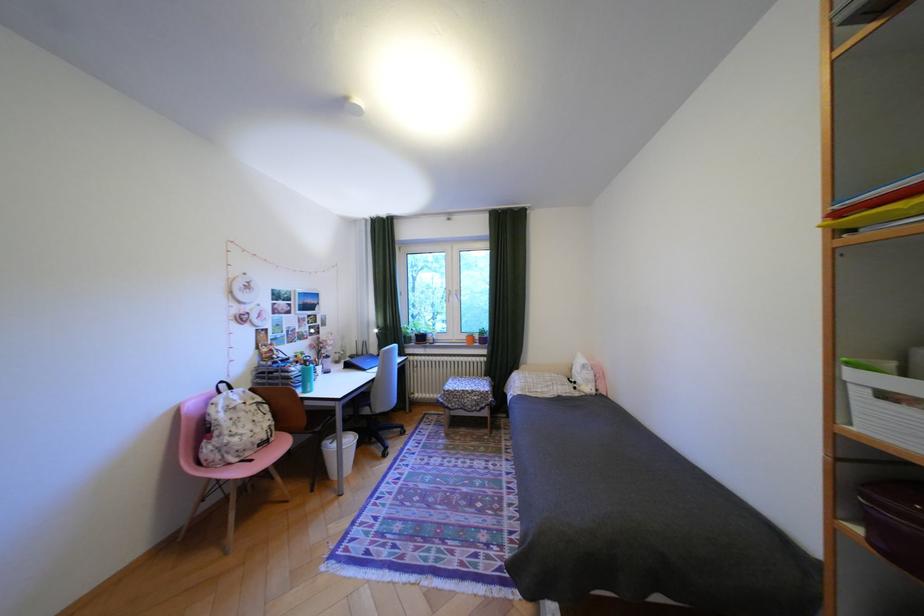
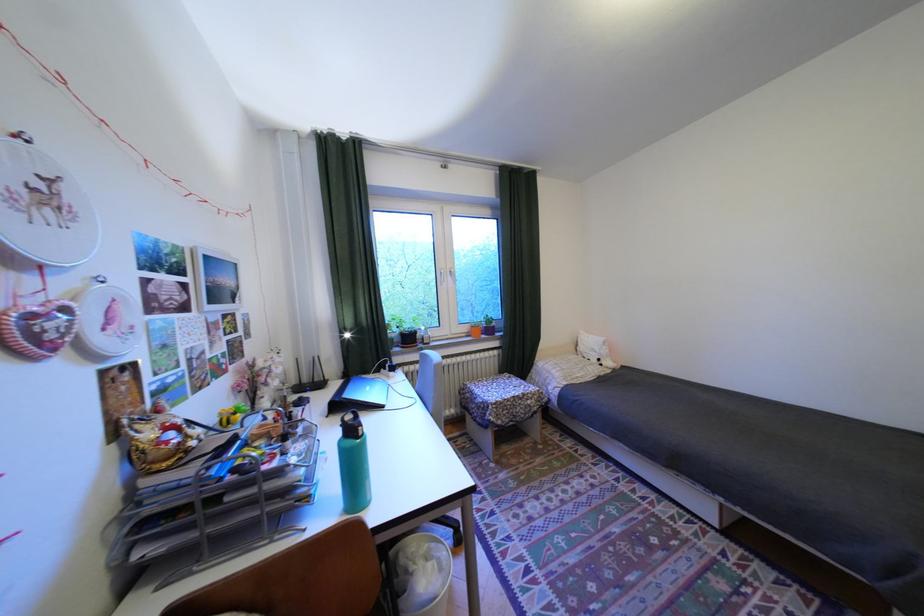
Locate, in the second image, the point that corresponds to the point at 416,325 in the first image.

(397, 322)